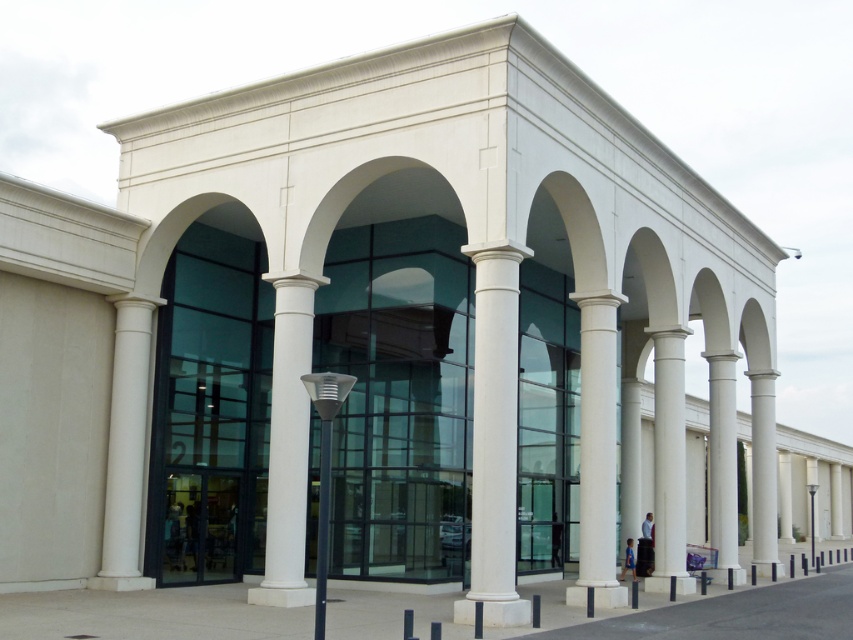
You are a delivery person carrying a heavy box and need to place it on the ground near the entrance of the building. The entrance is under the white marble column at center. Where should you place the box so it stays on the slate gray concrete pavement at center and not under the column?

The slate gray concrete pavement at center is positioned under the white marble column at center, so placing the box directly under the column would place it on the pavement. However, since the column itself is above the pavement, you should place the box near the base of the white marble column at center on the slate gray concrete pavement at center to ensure it stays on the pavement and not under the column itself.

You are standing at the entrance of the modern architectural structure and see the point marked as point (718, 612). Based on the scene description, what type of surface is located at that point?

The point (718, 612) corresponds to the slate gray concrete pavement at center, which is a solid surface made of concrete material.

You are standing at the entrance of the building and want to step onto the white smooth column at center. Is the slate gray concrete pavement at center between you and the column?

The slate gray concrete pavement at center is closer to the viewer than the white smooth column at center, so yes, the pavement is between you and the column.